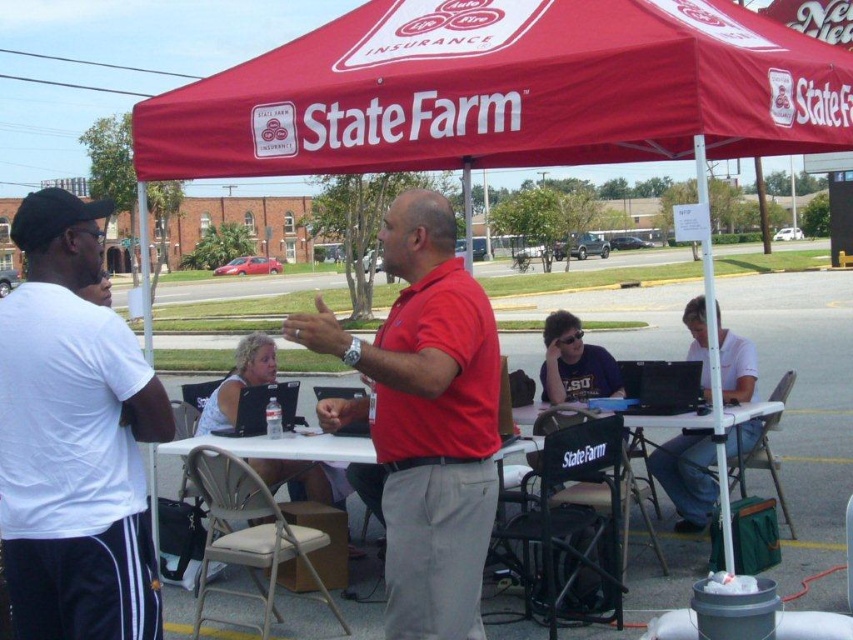
Question: Is red fabric canopy at upper center thinner than white matte shirt at center?

Choices:
 (A) no
 (B) yes

Answer: (A)

Question: Does white cotton t-shirt at left have a greater width compared to white plastic picnic table at center?

Choices:
 (A) no
 (B) yes

Answer: (A)

Question: Which is nearer to the white plastic picnic table at center?

Choices:
 (A) red matte shirt at center
 (B) white plastic table at center
 (C) red fabric canopy at upper center
 (D) white matte shirt at center

Answer: (A)

Question: Does white cotton t-shirt at left appear over red matte shirt at center?

Choices:
 (A) no
 (B) yes

Answer: (A)

Question: Which object appears closest to the camera in this image?

Choices:
 (A) red matte shirt at center
 (B) white plastic table at center
 (C) white matte shirt at center

Answer: (A)

Question: Which point is farther to the camera?

Choices:
 (A) white plastic table at center
 (B) red fabric canopy at upper center
 (C) white matte shirt at center
 (D) white cotton t-shirt at left

Answer: (C)